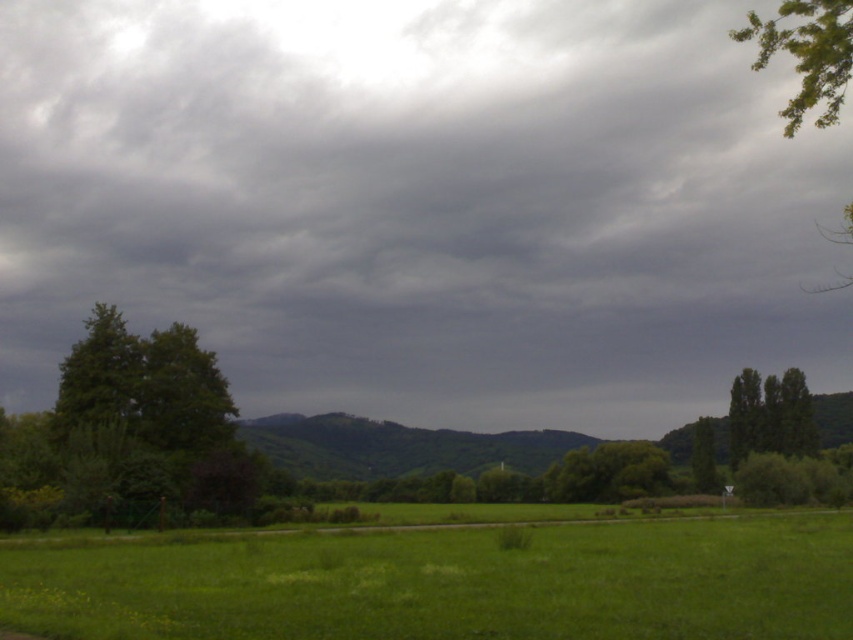
Does gray matte cloud at upper center have a greater width compared to green leafy tree at upper right?

Correct, the width of gray matte cloud at upper center exceeds that of green leafy tree at upper right.

Measure the distance from gray matte cloud at upper center to green leafy tree at upper right.

gray matte cloud at upper center is 270.09 feet away from green leafy tree at upper right.

Who is more forward, (300, 410) or (822, 90)?

Point (822, 90) is more forward.

Find the location of a particular element. Image resolution: width=853 pixels, height=640 pixels. gray matte cloud at upper center is located at coordinates (421, 204).

Is green leafy tree at upper right shorter than green leafy tree at center?

In fact, green leafy tree at upper right may be taller than green leafy tree at center.

Between point (799, 84) and point (694, 460), which one is positioned in front?

Positioned in front is point (694, 460).

Where is `green leafy tree at upper right`? The image size is (853, 640). green leafy tree at upper right is located at coordinates (805, 54).

Is point (848, 618) positioned in front of point (693, 461)?

Yes, it is in front of point (693, 461).

Can you confirm if green grass at lower center is bigger than green leafy tree at center?

Correct, green grass at lower center is larger in size than green leafy tree at center.

Between point (720, 548) and point (698, 435), which one is positioned in front?

Point (720, 548) is more forward.

Find the location of a particular element. green grass at lower center is located at coordinates (451, 584).